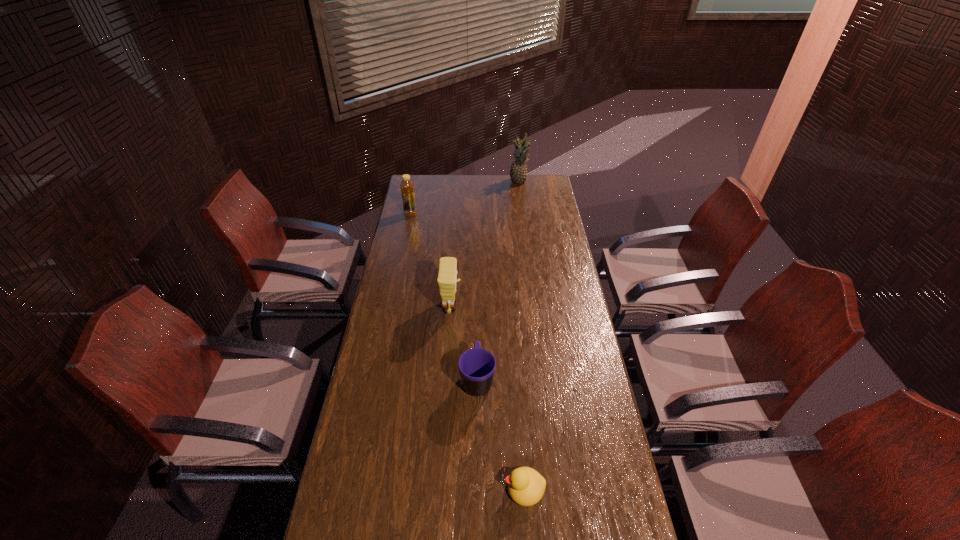
In order to click on vacant space that satisfies the following two spatial constraints: 1. on the front side of the pineapple; 2. on the face of the duckling in this screenshot , I will do `click(559, 489)`.